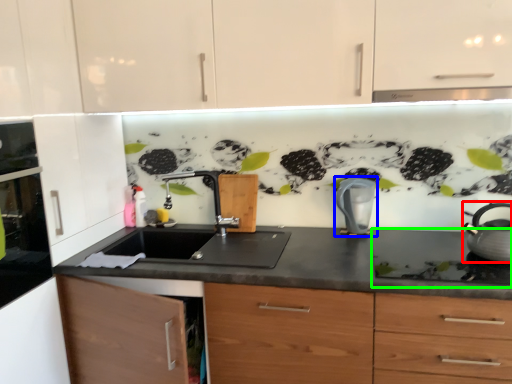
Question: Which object is the farthest from kitchen appliance (highlighted by a red box)? Choose among these: kitchen appliance (highlighted by a blue box) or gas stove (highlighted by a green box).

Choices:
 (A) kitchen appliance
 (B) gas stove

Answer: (A)